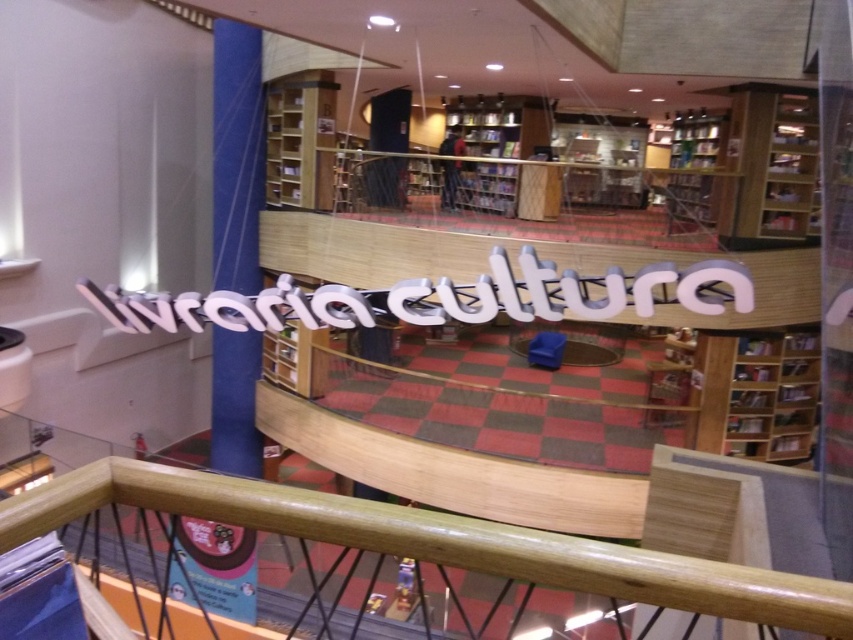
Question: Does wooden bookshelf at center lie in front of wooden bookshelf at upper right?

Choices:
 (A) no
 (B) yes

Answer: (A)

Question: Which point is farther to the camera?

Choices:
 (A) glossy wood rail at center
 (B) wooden bookshelf at upper right

Answer: (B)

Question: Is the position of wooden bookshelf at lower right less distant than that of wooden bookshelf at upper right?

Choices:
 (A) no
 (B) yes

Answer: (B)

Question: Which of the following is the farthest from the observer?

Choices:
 (A) wooden bookshelf at upper right
 (B) wooden bookshelf at center
 (C) wooden bookshelf at lower right

Answer: (B)

Question: Among these objects, which one is nearest to the camera?

Choices:
 (A) glossy wood rail at center
 (B) wooden bookshelf at center
 (C) wooden bookshelf at lower right

Answer: (A)

Question: Is wooden bookshelf at center bigger than wooden bookshelf at upper right?

Choices:
 (A) no
 (B) yes

Answer: (A)